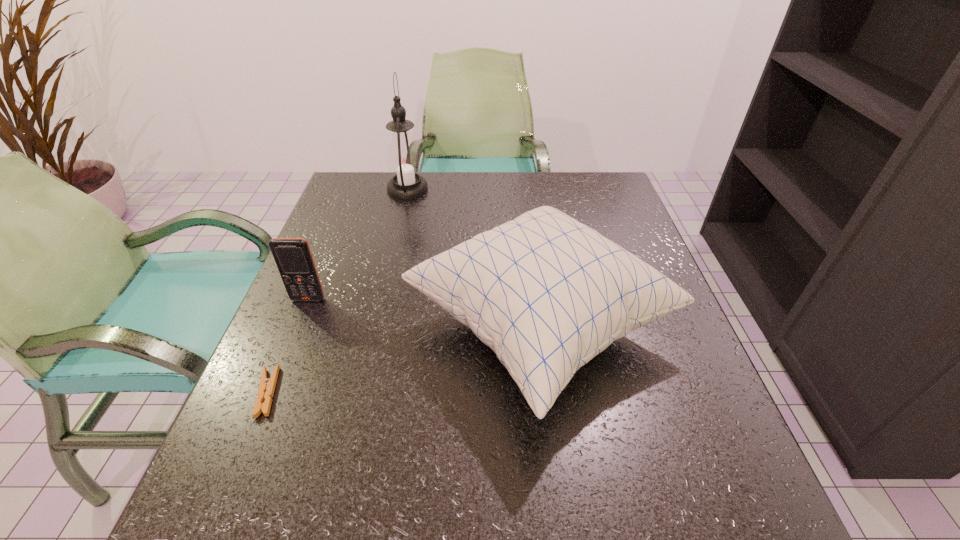
This screenshot has width=960, height=540. I want to click on object that is the closest one to the cellular telephone, so click(265, 393).

Find the location of a particular element. vacant space that satisfies the following two spatial constraints: 1. on the screen of the cushion; 2. on the right side of the second shortest object is located at coordinates (297, 327).

Locate an element on the screen. free space that satisfies the following two spatial constraints: 1. on the screen of the second shortest object; 2. on the left side of the cushion is located at coordinates (297, 327).

This screenshot has width=960, height=540. What are the coordinates of `free space that satisfies the following two spatial constraints: 1. on the back side of the second tallest object; 2. on the right side of the shortest object` in the screenshot? It's located at (295, 327).

At what (x,y) coordinates should I click in order to perform the action: click on blank area in the image that satisfies the following two spatial constraints: 1. on the screen of the rightmost object; 2. on the right side of the cellular telephone. Please return your answer as a coordinate pair (x, y). This screenshot has width=960, height=540. Looking at the image, I should click on (297, 327).